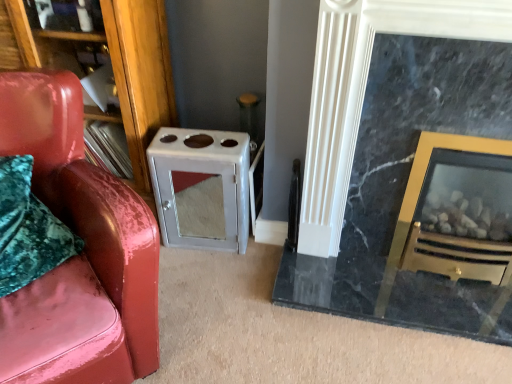
You are a GUI agent. You are given a task and a screenshot of the screen. Output one action in this format:
    pyautogui.click(x=<x>, y=<y>)
    Task: Click on the free space in front of black marble fireplace at right
    The image size is (512, 384).
    Given the screenshot: What is the action you would take?
    pyautogui.click(x=426, y=315)